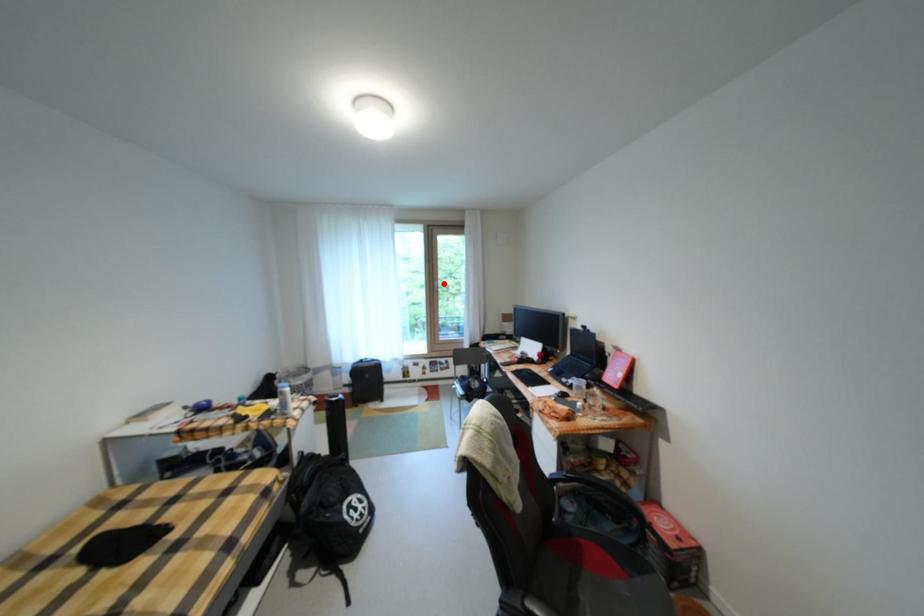
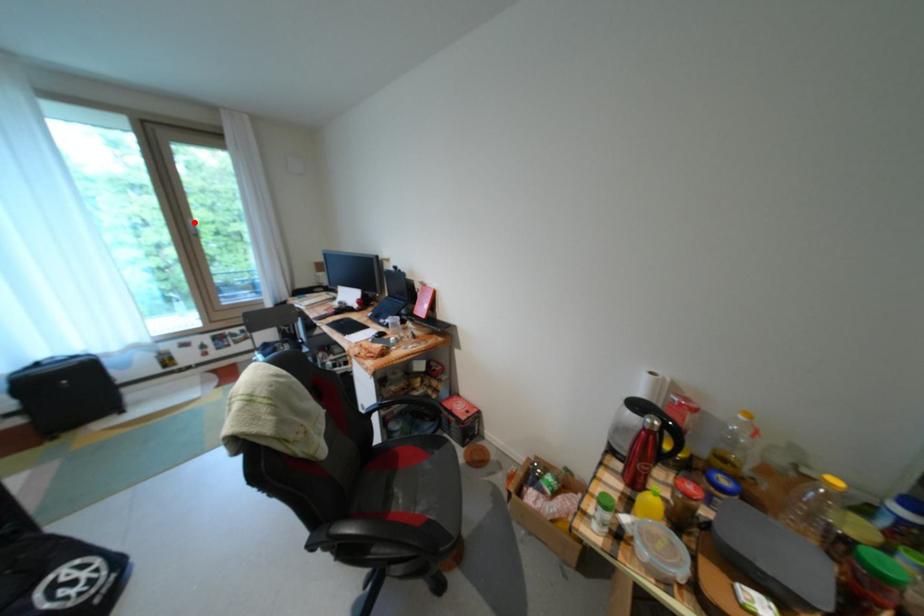
I am providing you with two images of the same scene from different viewpoints. A red point is marked on the first image and another point is marked on the second image. Does the point marked in image1 correspond to the same location as the one in image2?

Yes